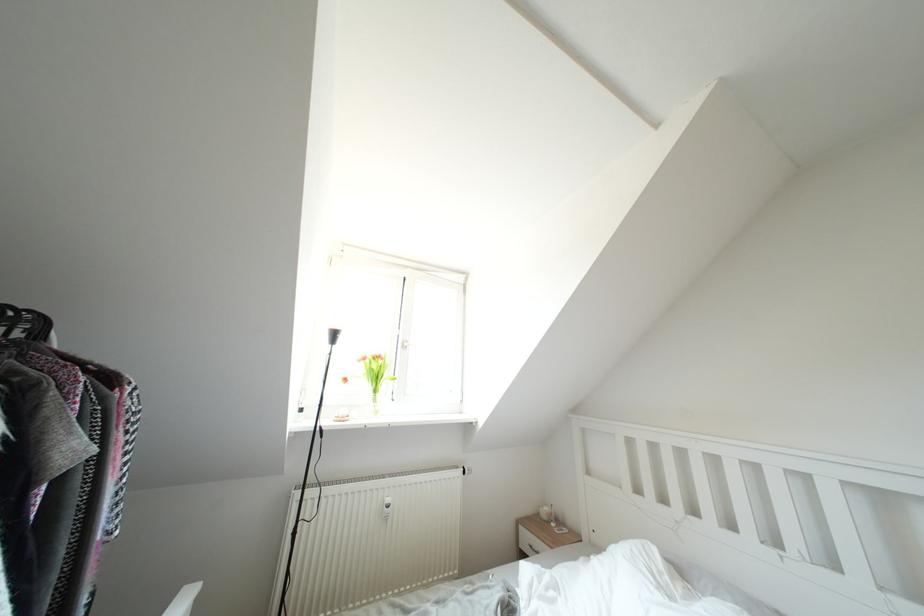
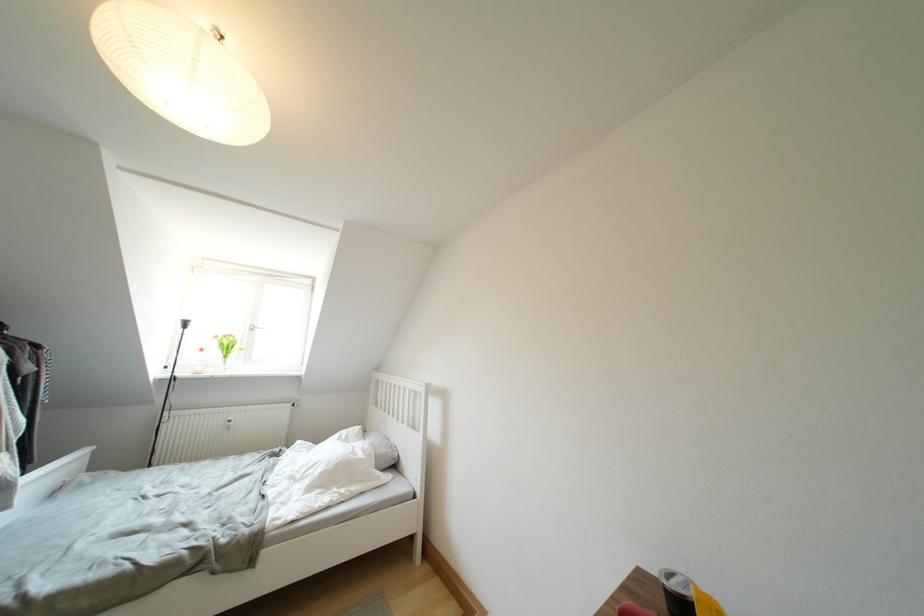
The point at (x=370, y=363) is marked in the first image. Where is the corresponding point in the second image?

(222, 341)